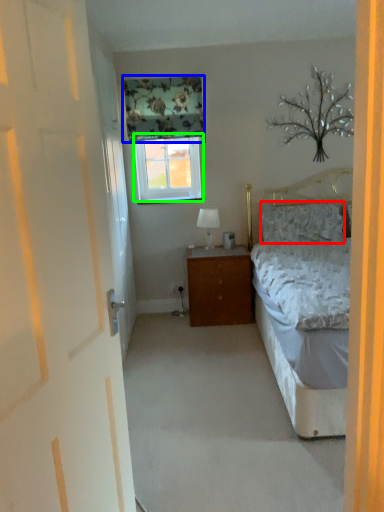
Question: Estimate the real-world distances between objects in this image. Which object is farther from pillow (highlighted by a red box), curtain (highlighted by a blue box) or window (highlighted by a green box)?

Choices:
 (A) curtain
 (B) window

Answer: (A)